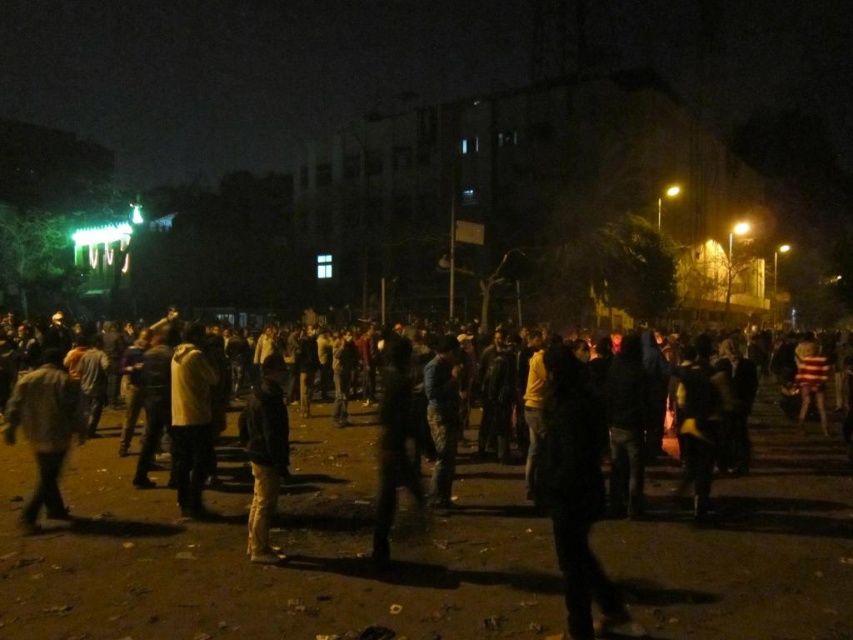
Consider the image. You are standing at the center of the scene and want to pick up the dark gray jacket at lower left. In which direction should you move to reach it?

You should move towards the lower left direction to reach the dark gray jacket at lower left.

You are a photographer trying to capture a photo of the dark gray jacket at lower left and dark gray jacket at center. Which jacket should you focus on to ensure it appears taller in the photo?

The dark gray jacket at lower left is taller than the dark gray jacket at center, so focusing on it will ensure the taller jacket is captured in the photo.